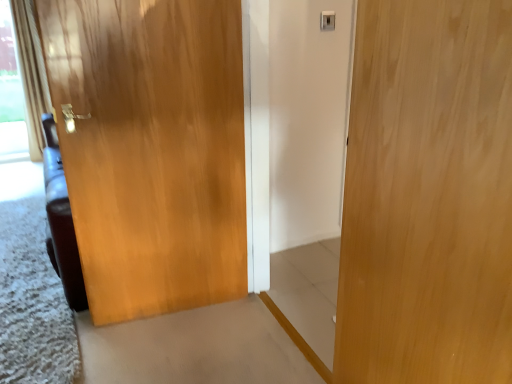
Question: From the image's perspective, is beige textured curtain at left located above light wood door at center, placed as the 1th door when sorted from right to left?

Choices:
 (A) yes
 (B) no

Answer: (A)

Question: Considering the relative positions of beige textured curtain at left and light wood door at center, placed as the 1th door when sorted from right to left, in the image provided, is beige textured curtain at left to the left of light wood door at center, placed as the 1th door when sorted from right to left, from the viewer's perspective?

Choices:
 (A) no
 (B) yes

Answer: (B)

Question: Considering the relative positions of beige textured curtain at left and light wood door at center, the second door in the back-to-front sequence, in the image provided, is beige textured curtain at left to the right of light wood door at center, the second door in the back-to-front sequence, from the viewer's perspective?

Choices:
 (A) yes
 (B) no

Answer: (B)

Question: Is light wood door at center, acting as the first door starting from the front, at the back of beige textured curtain at left?

Choices:
 (A) yes
 (B) no

Answer: (B)

Question: Would you consider beige textured curtain at left to be distant from light wood door at center, the second door in the back-to-front sequence?

Choices:
 (A) yes
 (B) no

Answer: (A)

Question: Is light wood door at center, acting as the first door starting from the front, wider or thinner than glossy wood door at left, arranged as the 2th door when viewed from the front?

Choices:
 (A) wide
 (B) thin

Answer: (B)

Question: Is light wood door at center, the second door in the back-to-front sequence, inside or outside of glossy wood door at left, which is the first door from back to front?

Choices:
 (A) inside
 (B) outside

Answer: (B)

Question: Is light wood door at center, the second door in the back-to-front sequence, in front of or behind glossy wood door at left, arranged as the 2th door when viewed from the front, in the image?

Choices:
 (A) front
 (B) behind

Answer: (A)

Question: From the image's perspective, is light wood door at center, placed as the 1th door when sorted from right to left, above or below glossy wood door at left, the second door from the right?

Choices:
 (A) above
 (B) below

Answer: (B)

Question: Is light wood door at center, the 2th door from the left, wider or thinner than beige textured curtain at left?

Choices:
 (A) thin
 (B) wide

Answer: (A)

Question: Is light wood door at center, placed as the 1th door when sorted from right to left, to the left or to the right of beige textured curtain at left in the image?

Choices:
 (A) right
 (B) left

Answer: (A)

Question: Considering the positions of light wood door at center, the second door in the back-to-front sequence, and beige textured curtain at left in the image, is light wood door at center, the second door in the back-to-front sequence, taller or shorter than beige textured curtain at left?

Choices:
 (A) tall
 (B) short

Answer: (B)

Question: Based on their sizes in the image, would you say light wood door at center, placed as the 1th door when sorted from right to left, is bigger or smaller than beige textured curtain at left?

Choices:
 (A) big
 (B) small

Answer: (B)

Question: Is glossy wood door at left, the second door from the right, to the left or to the right of beige textured curtain at left in the image?

Choices:
 (A) left
 (B) right

Answer: (B)

Question: From a real-world perspective, relative to beige textured curtain at left, is glossy wood door at left, arranged as the 2th door when viewed from the front, vertically above or below?

Choices:
 (A) above
 (B) below

Answer: (B)